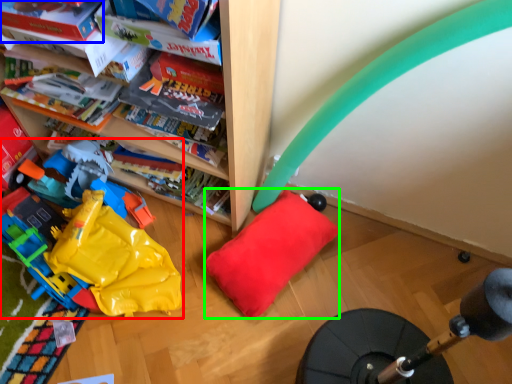
Question: Which is nearer to the toy (highlighted by a red box)? book (highlighted by a blue box) or pillow (highlighted by a green box).

Choices:
 (A) book
 (B) pillow

Answer: (B)